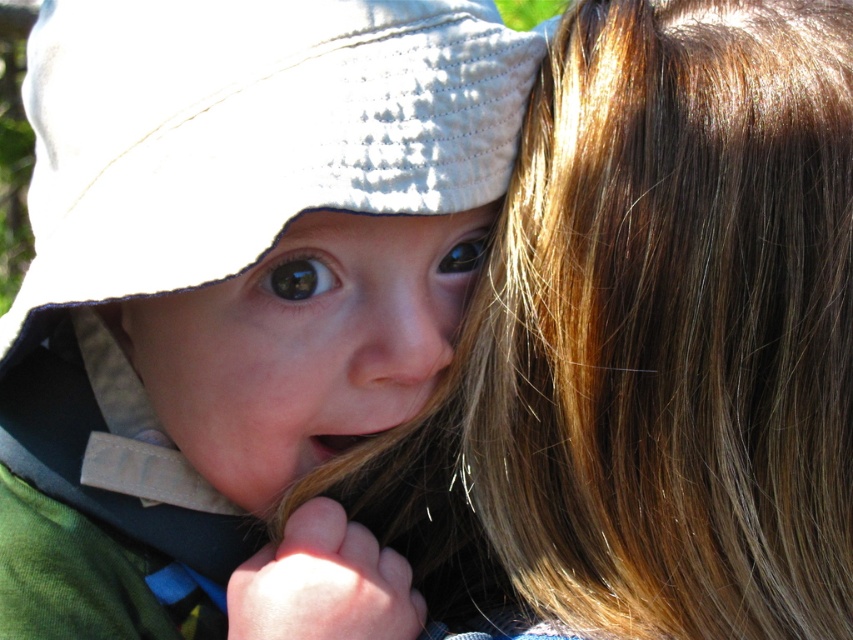
Question: Is smooth brown hair at upper right closer to camera compared to smooth skin face at center?

Choices:
 (A) yes
 (B) no

Answer: (B)

Question: Which point is farther to the camera?

Choices:
 (A) (465, 268)
 (B) (13, 365)
 (C) (622, 579)

Answer: (A)

Question: Which point is farther to the camera?

Choices:
 (A) smooth skin face at center
 (B) matte white hat at upper left
 (C) glossy blue eye at center
 (D) black glossy eye at center

Answer: (C)

Question: Is matte white hat at upper left to the left of smooth skin face at center from the viewer's perspective?

Choices:
 (A) yes
 (B) no

Answer: (A)

Question: Can you confirm if smooth brown hair at upper right is smaller than smooth skin face at center?

Choices:
 (A) yes
 (B) no

Answer: (B)

Question: Which point is closer to the camera taking this photo?

Choices:
 (A) (418, 458)
 (B) (485, 237)
 (C) (155, 438)

Answer: (B)